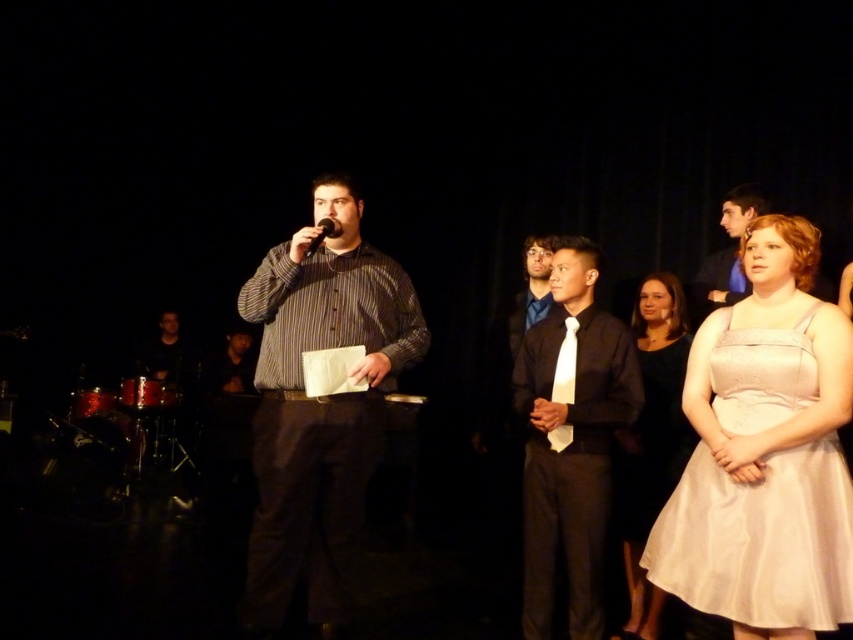
Is satin white dress at right shorter than matte blue shirt at center?

No, satin white dress at right is not shorter than matte blue shirt at center.

Between satin white dress at right and matte blue shirt at center, which one is positioned higher?

matte blue shirt at center is above.

Which is in front, point (677, 589) or point (537, 237)?

Positioned in front is point (677, 589).

The width and height of the screenshot is (853, 640). Find the location of `satin white dress at right`. satin white dress at right is located at coordinates (759, 540).

Is black satin shirt at center smaller than dark blue shirt at left?

No, black satin shirt at center is not smaller than dark blue shirt at left.

Is black satin shirt at center bigger than dark blue shirt at left?

Yes, black satin shirt at center is bigger than dark blue shirt at left.

Does point (563, 442) lie behind point (172, 310)?

No, it is in front of (172, 310).

The height and width of the screenshot is (640, 853). I want to click on black satin shirt at center, so click(x=572, y=440).

Is striped shirt at center above dark blue shirt at left?

Yes, striped shirt at center is above dark blue shirt at left.

Between striped shirt at center and dark blue shirt at left, which one has less height?

Standing shorter between the two is dark blue shirt at left.

Identify the location of striped shirt at center. (318, 404).

This screenshot has width=853, height=640. I want to click on striped shirt at center, so click(x=318, y=404).